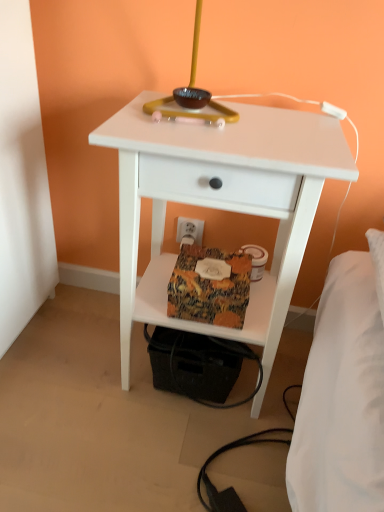
At what (x,y) coordinates should I click in order to perform the action: click on vacant point above textured fabric package at lower center (from a real-world perspective). Please return your answer as a coordinate pair (x, y). The width and height of the screenshot is (384, 512). Looking at the image, I should click on (213, 271).